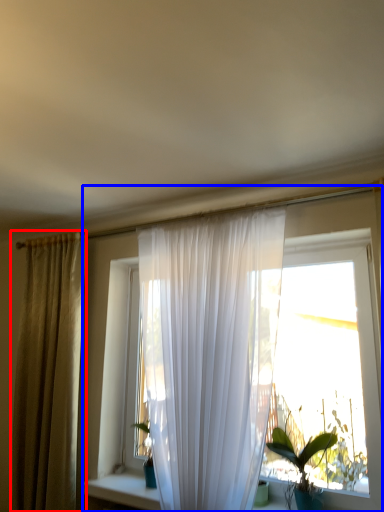
Question: Which of the following is the farthest to the observer, curtain (highlighted by a red box) or window (highlighted by a blue box)?

Choices:
 (A) curtain
 (B) window

Answer: (A)